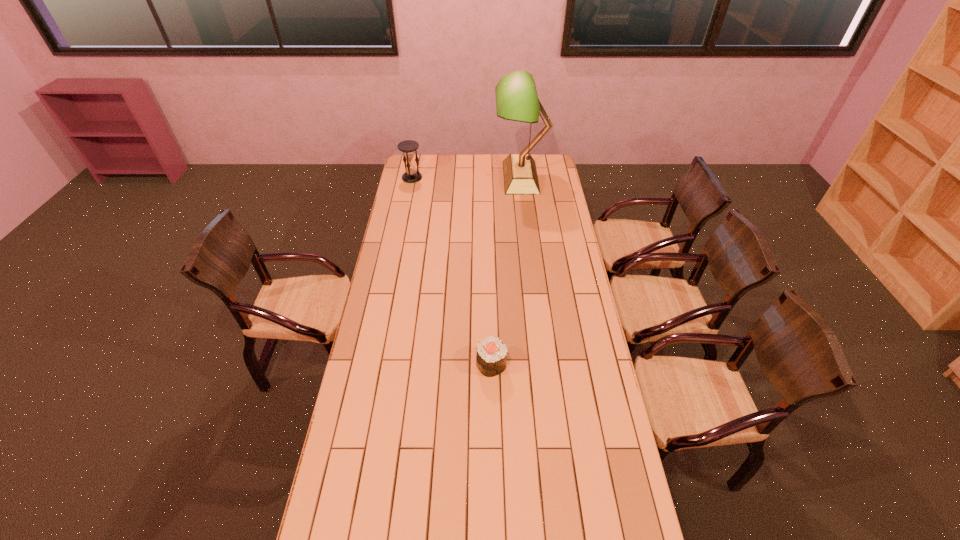
Point out which object is positioned as the second nearest to the shortest object. Please provide its 2D coordinates. Your answer should be formatted as a tuple, i.e. [(x, y)], where the tuple contains the x and y coordinates of a point satisfying the conditions above.

[(409, 147)]

At what (x,y) coordinates should I click in order to perform the action: click on vacant space that satisfies the following two spatial constraints: 1. on the metallic stand of the table lamp; 2. on the front side of the second tallest object. Please return your answer as a coordinate pair (x, y). This screenshot has width=960, height=540. Looking at the image, I should click on (521, 178).

I want to click on vacant space that satisfies the following two spatial constraints: 1. on the metallic stand of the tallest object; 2. on the front side of the leftmost object, so click(x=521, y=178).